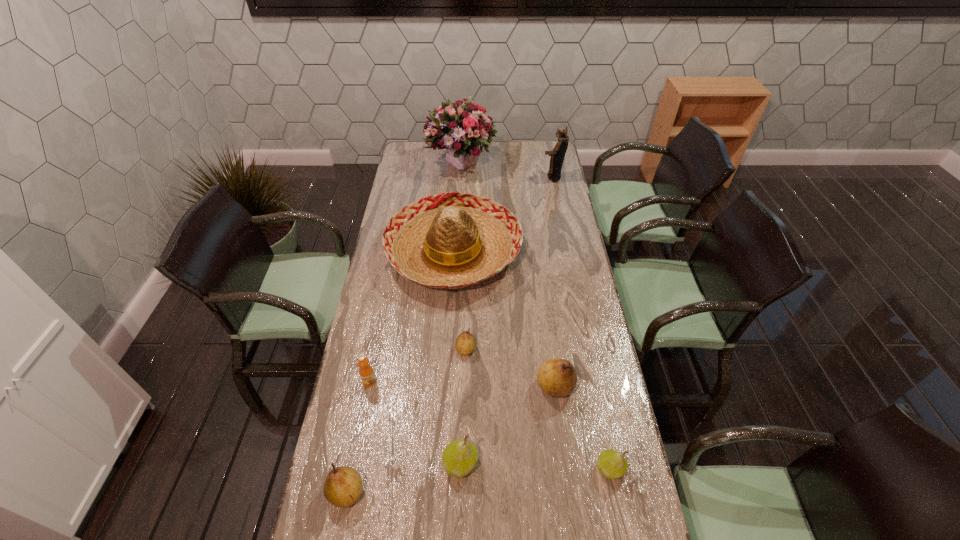
At what (x,y) coordinates should I click in order to perform the action: click on vacant space that satisfies the following two spatial constraints: 1. on the front side of the bouquet; 2. on the left side of the fourth pear from left to right. Please return your answer as a coordinate pair (x, y). Looking at the image, I should click on (449, 386).

I want to click on blank space that satisfies the following two spatial constraints: 1. on the front side of the smaller green pear; 2. on the left side of the bigger green pear, so click(x=460, y=469).

Find the location of a particular element. The image size is (960, 540). free location that satisfies the following two spatial constraints: 1. on the front label of the smaller green pear; 2. on the right side of the orange juice is located at coordinates (352, 469).

This screenshot has width=960, height=540. What are the coordinates of `free space that satisfies the following two spatial constraints: 1. on the back side of the third tallest object; 2. on the right side of the bouquet` in the screenshot? It's located at (459, 164).